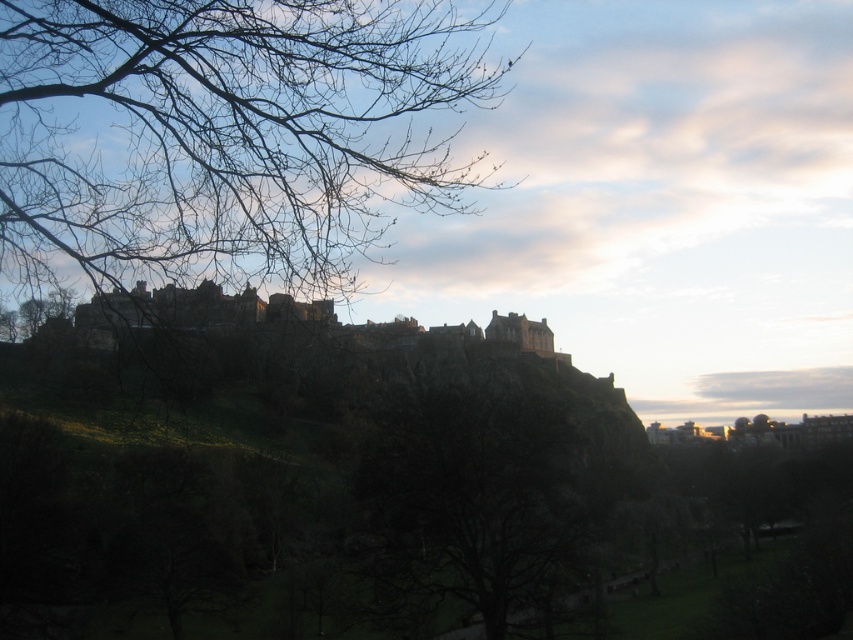
You are an architect analyzing the composition of this image. Looking at the bare branches at upper left and the bare branches at center, which one appears to be closer to the viewer based on their size?

The bare branches at upper left is much taller than the bare branches at center, so it appears closer to the viewer.